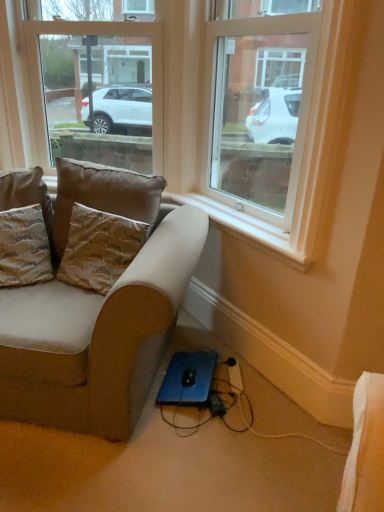
Question: Does point (114, 45) appear closer or farther from the camera than point (23, 172)?

Choices:
 (A) closer
 (B) farther

Answer: (B)

Question: Considering the positions of clear glass window at upper center, which ranks as the second window in right-to-left order, and textured brown pillow at left, the first pillow viewed from the left, in the image, is clear glass window at upper center, which ranks as the second window in right-to-left order, taller or shorter than textured brown pillow at left, the first pillow viewed from the left,?

Choices:
 (A) tall
 (B) short

Answer: (A)

Question: Estimate the real-world distances between objects in this image. Which object is farther from the clear glass window at upper center, marked as the 2th window in a left-to-right arrangement?

Choices:
 (A) brown fabric pillow at upper left, the 2th pillow from the right
 (B) brown textured pillow at left, the 1th pillow viewed from the right
 (C) beige fabric couch at lower left
 (D) clear glass window at upper center, marked as the 1th window in a left-to-right arrangement
 (E) black plastic extension cord at lower center

Answer: (E)

Question: Which is nearer to the textured brown pillow at left, placed as the 4th pillow when sorted from right to left?

Choices:
 (A) black plastic extension cord at lower center
 (B) beige fabric couch at lower left
 (C) brown fabric pillow at upper left, positioned as the third pillow in left-to-right order
 (D) brown textured pillow at left, the 1th pillow viewed from the right
 (E) textured brown pillow at left, the 3th pillow viewed from the right

Answer: (E)